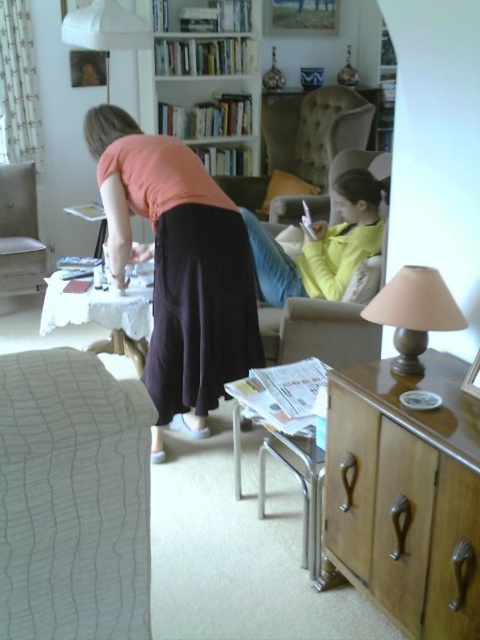
You are sitting in the light brown fabric armchair at left and want to reach the beige fabric lampshade at right on the sideboard. Is the lampshade within your immediate reach without getting up?

The beige fabric lampshade at right is to the right of the light brown fabric armchair at left, so it might be within reach depending on the distance between them. However, since the exact distance isn not provided, it is uncertain.

You are arranging flowers in the living room and need to place a vase between the white textured fabric at lower left and the beige fabric lampshade at right. Where should you place the vase to ensure it is between them?

The vase should be placed between the white textured fabric at lower left and the beige fabric lampshade at right, as the white textured fabric at lower left is positioned on the left side of the beige fabric lampshade at right.